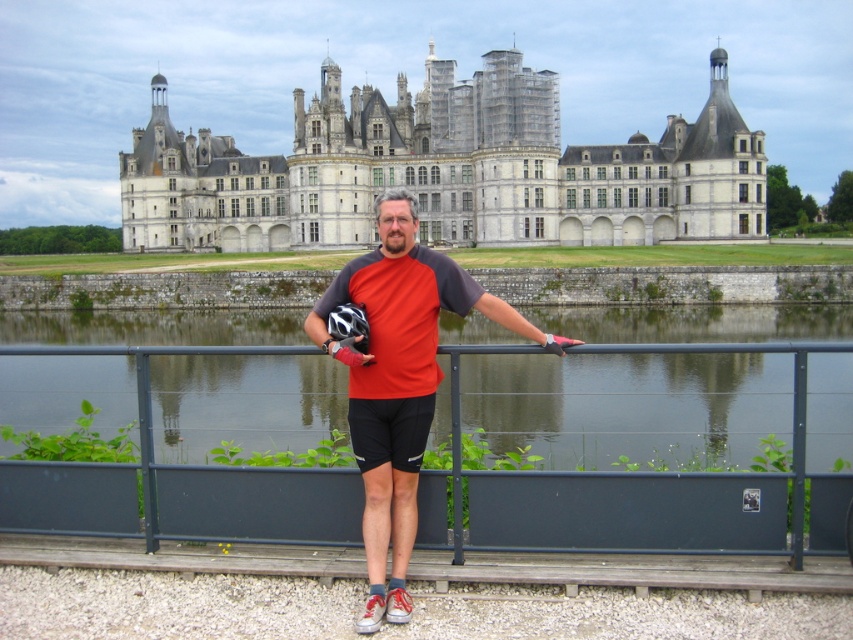
Which of these two, matte red shirt at center or black synthetic glove at center, stands shorter?

black synthetic glove at center

Which is behind, point (425, 378) or point (555, 336)?

Positioned behind is point (555, 336).

You are a GUI agent. You are given a task and a screenshot of the screen. Output one action in this format:
    pyautogui.click(x=<x>, y=<y>)
    Task: Click on the matte red shirt at center
    This screenshot has height=640, width=853.
    Given the screenshot: What is the action you would take?
    pyautogui.click(x=397, y=381)

Can you confirm if gray stone castle at upper center is positioned to the left of black synthetic glove at center?

Yes, gray stone castle at upper center is to the left of black synthetic glove at center.

Does gray stone castle at upper center have a larger size compared to black synthetic glove at center?

Yes.

The width and height of the screenshot is (853, 640). In order to click on gray stone castle at upper center in this screenshot , I will do `click(445, 170)`.

I want to click on gray stone castle at upper center, so click(445, 170).

At what (x,y) coordinates should I click in order to perform the action: click on gray stone castle at upper center. Please return your answer as a coordinate pair (x, y). Image resolution: width=853 pixels, height=640 pixels. Looking at the image, I should click on (445, 170).

Which is more to the left, gray stone castle at upper center or matte red shirt at center?

gray stone castle at upper center

Is point (123, 211) farther from viewer compared to point (426, 416)?

Yes.

The image size is (853, 640). I want to click on gray stone castle at upper center, so (445, 170).